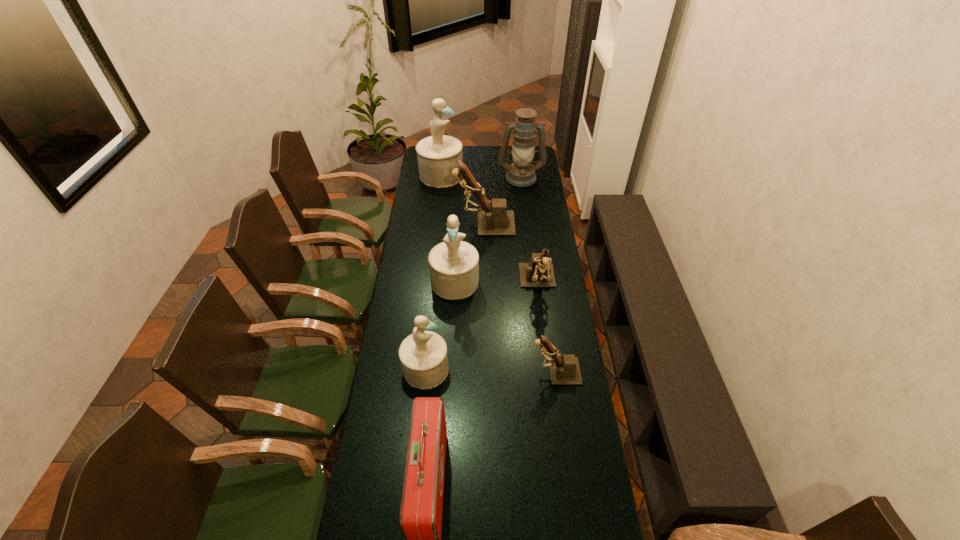
This screenshot has width=960, height=540. What are the coordinates of `vacant area situated on the front-facing side of the shortest object` in the screenshot? It's located at (472, 372).

Where is `object present at the far edge`? Image resolution: width=960 pixels, height=540 pixels. object present at the far edge is located at coordinates (438, 155).

This screenshot has height=540, width=960. What are the coordinates of `oil lamp that is at the right edge` in the screenshot? It's located at (521, 173).

You are a GUI agent. You are given a task and a screenshot of the screen. Output one action in this format:
    pyautogui.click(x=<x>, y=<y>)
    Task: Click on the object present at the far left corner
    
    Given the screenshot: What is the action you would take?
    pyautogui.click(x=438, y=155)

Image resolution: width=960 pixels, height=540 pixels. I want to click on free space at the far edge of the desktop, so click(x=476, y=160).

Where is `vacant area at the left edge`? The image size is (960, 540). vacant area at the left edge is located at coordinates (381, 479).

Where is `vacant region at the right edge`? Image resolution: width=960 pixels, height=540 pixels. vacant region at the right edge is located at coordinates (565, 403).

What are the coordinates of `vacant area that lies between the smallest white figurine and the second farthest white figurine` in the screenshot? It's located at (441, 325).

This screenshot has width=960, height=540. In order to click on vacant point located between the leftmost brown figurine and the second biggest brown figurine in this screenshot , I will do `click(511, 254)`.

Locate an element on the screen. Image resolution: width=960 pixels, height=540 pixels. vacant space that is in between the biggest brown figurine and the second biggest brown figurine is located at coordinates (511, 254).